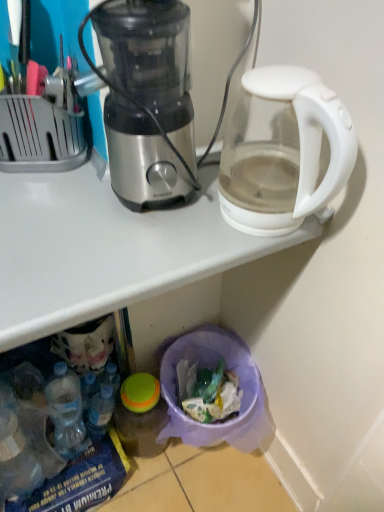
You are a GUI agent. You are given a task and a screenshot of the screen. Output one action in this format:
    pyautogui.click(x=<x>, y=<y>)
    Task: Click on the empty space that is ontop of transparent plastic trash bin at lower center (from a real-world perspective)
    
    Given the screenshot: What is the action you would take?
    pyautogui.click(x=101, y=217)